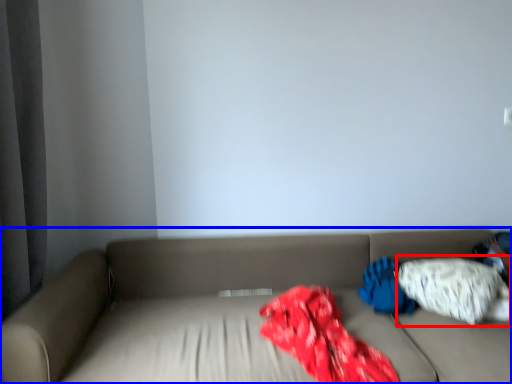
Question: Which of the following is the farthest to the observer, pillow (highlighted by a red box) or studio couch (highlighted by a blue box)?

Choices:
 (A) pillow
 (B) studio couch

Answer: (A)